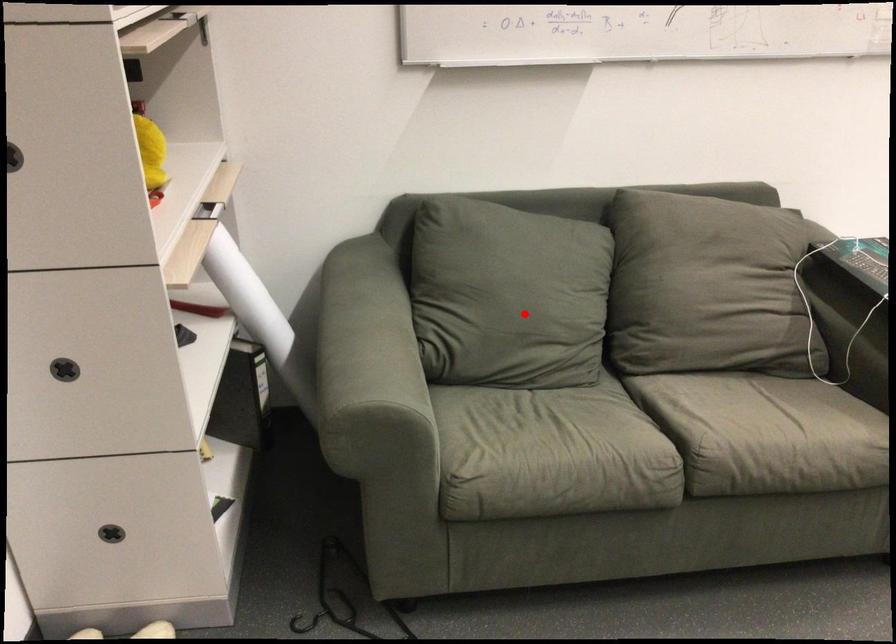
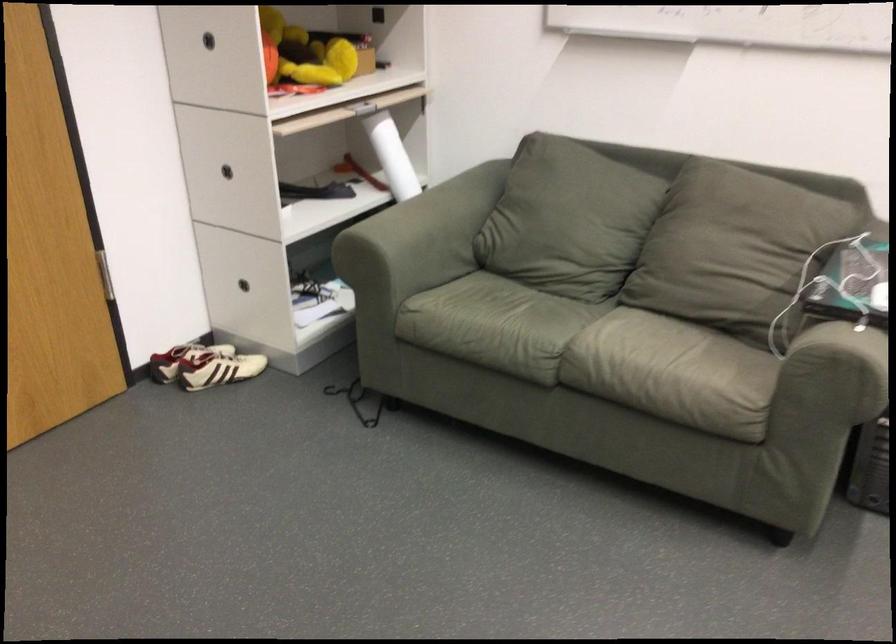
Question: A red point is marked in image1. In image2, is the corresponding 3D point closer to the camera or farther? Reply with the corresponding letter.

Choices:
 (A) The corresponding 3D point is closer.
 (B) The corresponding 3D point is farther.

Answer: (B)